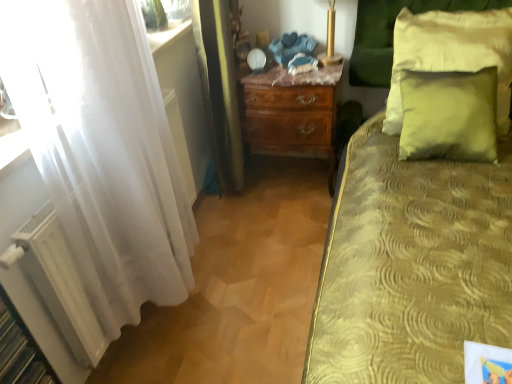
This screenshot has width=512, height=384. Identify the location of vacant space underneath white sheer curtain at left (from a real-world perspective). (182, 312).